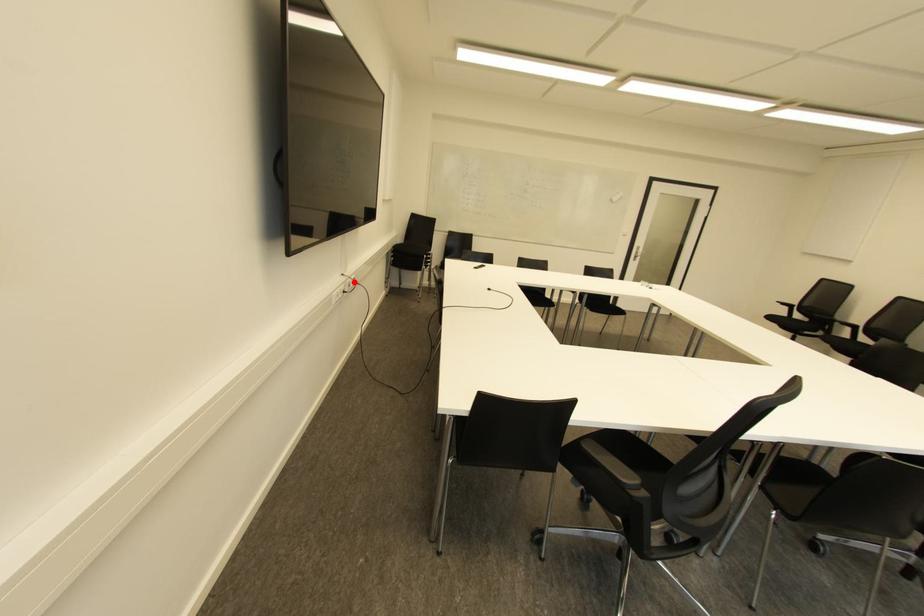
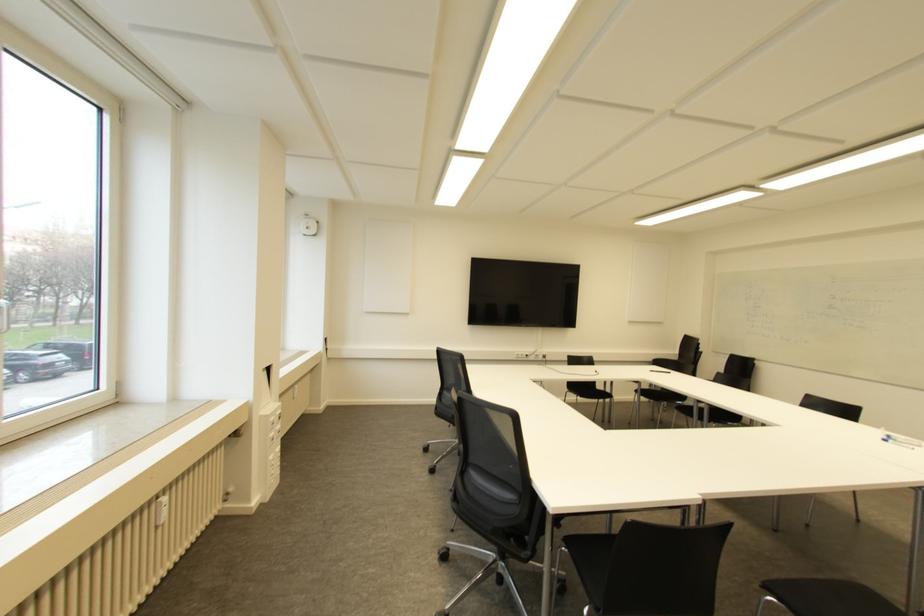
Locate, in the second image, the point that corresponds to the highlighted location in the first image.

(543, 355)